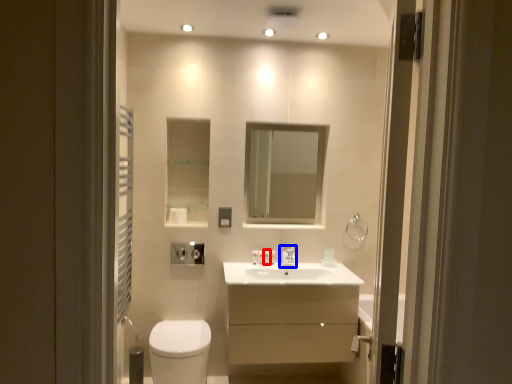
Question: Among these objects, which one is farthest to the camera, toiletry (highlighted by a red box) or tap (highlighted by a blue box)?

Choices:
 (A) toiletry
 (B) tap

Answer: (A)